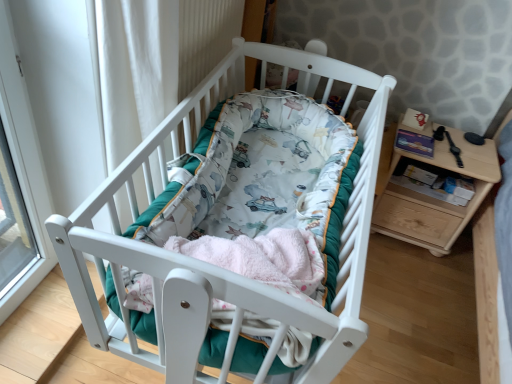
I want to click on fluffy pink blanket at center, so click(263, 258).

Identify the location of white wood crib at center. Image resolution: width=512 pixels, height=384 pixels. [211, 265].

Identify the location of wooden changing table at right. This screenshot has width=512, height=384. (434, 198).

Which of these two, fluffy pink blanket at center or black leather watch at right, stands taller?

Standing taller between the two is fluffy pink blanket at center.

Looking at the image, does fluffy pink blanket at center seem bigger or smaller compared to black leather watch at right?

Clearly, fluffy pink blanket at center is larger in size than black leather watch at right.

Is black leather watch at right to the left or to the right of fluffy pink blanket at center in the image?

Based on their positions, black leather watch at right is located to the right of fluffy pink blanket at center.

Can you tell me how much black leather watch at right and fluffy pink blanket at center differ in facing direction?

black leather watch at right and fluffy pink blanket at center are facing 78.1 degrees away from each other.

From a real-world perspective, which object stands above the other?

From a 3D spatial view, fluffy pink blanket at center is above.

From the picture: Could you tell me if black leather watch at right is facing fluffy pink blanket at center?

No, black leather watch at right does not turn towards fluffy pink blanket at center.

From a real-world perspective, which object stands above the other?

In real-world perspective, fluffy pink blanket at center is above.

Does wooden changing table at right touch fluffy pink blanket at center?

wooden changing table at right and fluffy pink blanket at center are clearly separated.

Does wooden changing table at right have a greater height compared to fluffy pink blanket at center?

Yes, wooden changing table at right is taller than fluffy pink blanket at center.

Locate an element on the screen. baby clothe above the wooden changing table at right (from a real-world perspective) is located at coordinates (263, 258).

Where is `infant bed located below the black leather watch at right (from the image's perspective)`? The height and width of the screenshot is (384, 512). infant bed located below the black leather watch at right (from the image's perspective) is located at coordinates (211, 265).

Does point (185, 379) appear closer or farther from the camera than point (435, 134)?

Point (185, 379) appears to be closer to the viewer than point (435, 134).

Who is taller, white wood crib at center or black leather watch at right?

white wood crib at center is taller.

Looking at this image, how different are the orientations of white wood crib at center and black leather watch at right in degrees?

They differ by 81.1 degrees in their facing directions.

You are a GUI agent. You are given a task and a screenshot of the screen. Output one action in this format:
    pyautogui.click(x=<x>, y=<y>)
    Task: Click on the equipment located on the right of white wood crib at center
    
    Given the screenshot: What is the action you would take?
    pyautogui.click(x=449, y=144)

Considering the sizes of objects black leather watch at right and white wood crib at center in the image provided, who is smaller, black leather watch at right or white wood crib at center?

black leather watch at right is smaller.

Can you confirm if black leather watch at right is shorter than white wood crib at center?

Yes.

Considering the relative positions of black leather watch at right and wooden changing table at right in the image provided, is black leather watch at right to the left of wooden changing table at right from the viewer's perspective?

No, black leather watch at right is not to the left of wooden changing table at right.

Is black leather watch at right taller than wooden changing table at right?

No, black leather watch at right is not taller than wooden changing table at right.

From a real-world perspective, is black leather watch at right positioned over wooden changing table at right based on gravity?

Indeed, from a real-world perspective, black leather watch at right stands above wooden changing table at right.

Which of these two, fluffy pink blanket at center or wooden changing table at right, stands shorter?

fluffy pink blanket at center is shorter.

Consider the image. Is wooden changing table at right a part of fluffy pink blanket at center?

Definitely not — wooden changing table at right is not inside fluffy pink blanket at center.

Is fluffy pink blanket at center looking in the opposite direction of wooden changing table at right?

fluffy pink blanket at center does not have its back to wooden changing table at right.

Considering the points (237, 244) and (479, 155), which point is behind, point (237, 244) or point (479, 155)?

The point (479, 155) is farther.

Image resolution: width=512 pixels, height=384 pixels. Find the location of `equipment above the fluffy pink blanket at center (from the image's perspective)`. equipment above the fluffy pink blanket at center (from the image's perspective) is located at coordinates (449, 144).

Identify the location of equipment on the right of the fluffy pink blanket at center. (449, 144).

From the image, which object appears to be farther from white wood crib at center, wooden changing table at right or fluffy pink blanket at center?

wooden changing table at right is positioned further to the anchor white wood crib at center.

Based on their spatial positions, is white wood crib at center or fluffy pink blanket at center further from black leather watch at right?

The object further to black leather watch at right is fluffy pink blanket at center.

When comparing their distances from wooden changing table at right, does fluffy pink blanket at center or white wood crib at center seem further?

fluffy pink blanket at center lies further to wooden changing table at right than the other object.

Looking at the image, which one is located further to black leather watch at right, wooden changing table at right or fluffy pink blanket at center?

The object further to black leather watch at right is fluffy pink blanket at center.

Considering their positions, is white wood crib at center positioned further to wooden changing table at right than black leather watch at right?

white wood crib at center lies further to wooden changing table at right than the other object.

Looking at the image, which one is located further to white wood crib at center, black leather watch at right or fluffy pink blanket at center?

black leather watch at right is further to white wood crib at center.

Which object lies nearer to the anchor point wooden changing table at right, black leather watch at right or white wood crib at center?

Based on the image, black leather watch at right appears to be nearer to wooden changing table at right.

Looking at the image, which one is located further to black leather watch at right, white wood crib at center or wooden changing table at right?

white wood crib at center lies further to black leather watch at right than the other object.

At what (x,y) coordinates should I click in order to perform the action: click on baby clothe positioned between white wood crib at center and wooden changing table at right from near to far. Please return your answer as a coordinate pair (x, y). The width and height of the screenshot is (512, 384). Looking at the image, I should click on (263, 258).

You are a GUI agent. You are given a task and a screenshot of the screen. Output one action in this format:
    pyautogui.click(x=<x>, y=<y>)
    Task: Click on the changing table positioned between fluffy pink blanket at center and black leather watch at right from near to far
    
    Given the screenshot: What is the action you would take?
    pyautogui.click(x=434, y=198)

Identify the location of changing table between white wood crib at center and black leather watch at right in the front-back direction. The height and width of the screenshot is (384, 512). (434, 198).

This screenshot has height=384, width=512. In order to click on baby clothe between white wood crib at center and black leather watch at right in the front-back direction in this screenshot , I will do pyautogui.click(x=263, y=258).